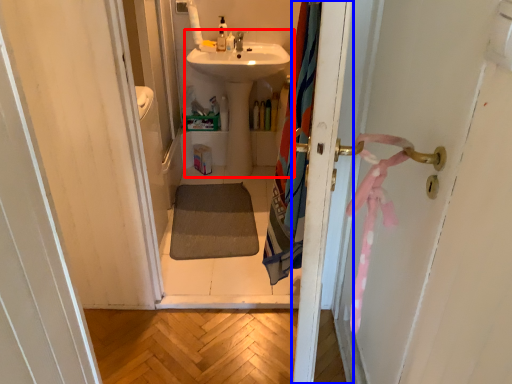
Question: Which object is closer to the camera taking this photo, sink (highlighted by a red box) or screen door (highlighted by a blue box)?

Choices:
 (A) sink
 (B) screen door

Answer: (B)